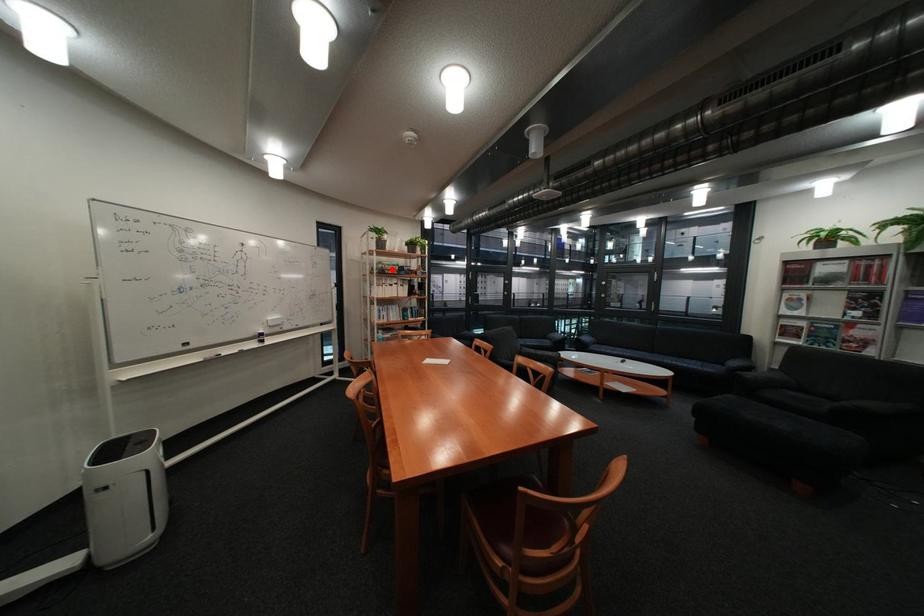
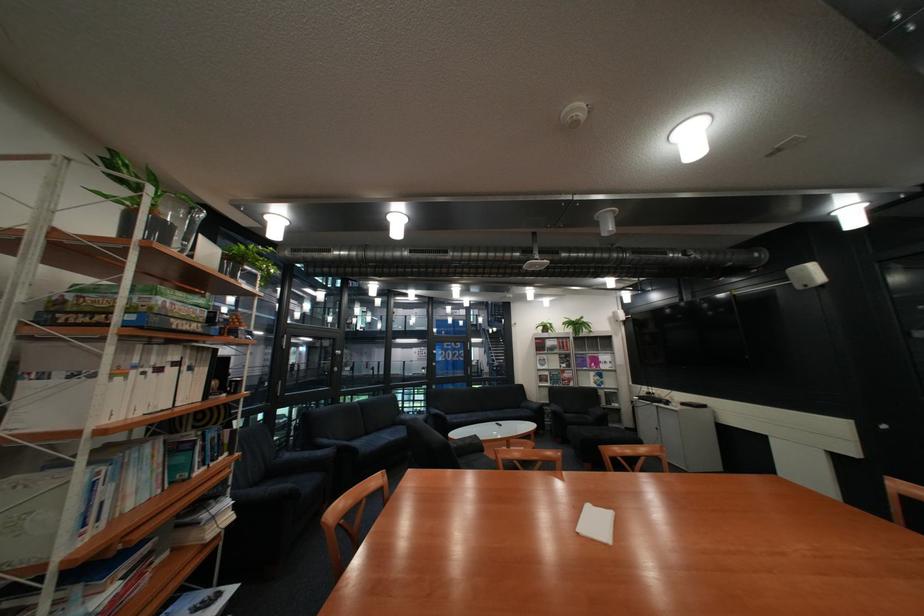
Question: I am providing you with two images of the same scene from different viewpoints. A red point is marked on the first image. At the location where the point appears in image 1, is it still visible in image 2?

Choices:
 (A) Yes
 (B) No

Answer: (A)